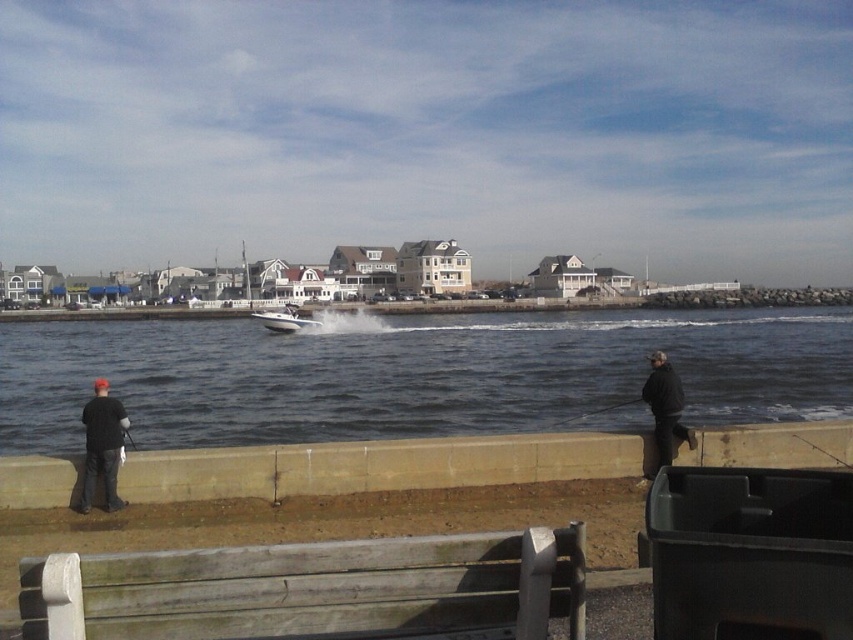
Which is above, dark blue water at center or matte black jacket at left?

Positioned higher is dark blue water at center.

Does dark blue water at center have a greater width compared to matte black jacket at left?

Yes.

Find the location of a particular element. The height and width of the screenshot is (640, 853). dark blue water at center is located at coordinates (416, 374).

Does point (235, 612) come behind point (595, 412)?

No, (235, 612) is in front of (595, 412).

Is point (354, 593) closer to viewer compared to point (581, 413)?

Yes, it is in front of point (581, 413).

Image resolution: width=853 pixels, height=640 pixels. I want to click on weathered wood bench at lower center, so click(x=315, y=589).

Who is shorter, weathered wood bench at lower center or white glossy boat at center?

Standing shorter between the two is weathered wood bench at lower center.

Does weathered wood bench at lower center have a lesser width compared to white glossy boat at center?

Yes.

Is point (62, 627) farther from viewer compared to point (318, 323)?

No, it is in front of (318, 323).

Find the location of a particular element. The height and width of the screenshot is (640, 853). weathered wood bench at lower center is located at coordinates (315, 589).